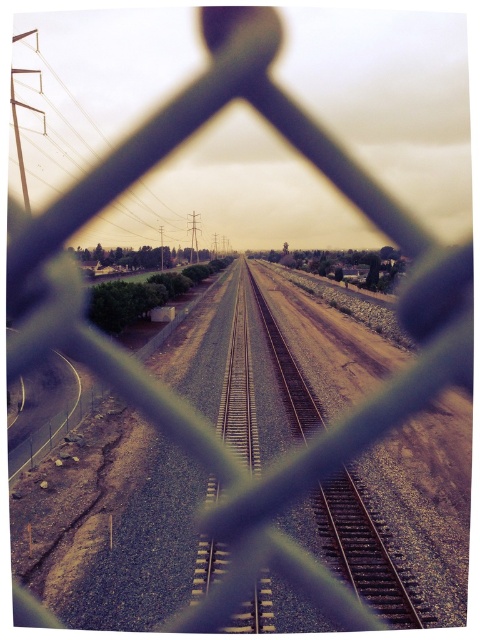
You are a maintenance worker needing to inspect both the rusty metal train track at center and the metallic silver power line at upper left. Given that you can walk at a speed of 1.5 meters per second, how many seconds will it take you to walk from one to the other?

The rusty metal train track at center and the metallic silver power line at upper left are 190.44 meters apart from each other. At a walking speed of 1.5 meters per second, it would take approximately 127 seconds to walk between them.

You are a bird flying over the scene. You want to land on the tallest object between the rusty metal train track at center and the metallic silver power line at upper left. Which object should you choose?

The metallic silver power line at upper left is taller than the rusty metal train track at center, so you should land on the metallic silver power line at upper left.

You are standing behind the chain link fence looking at the scene. Can you see the metallic silver power line at upper left through the rusty metal train track at center?

Yes, because the rusty metal train track at center is in front of the metallic silver power line at upper left, so the power line is behind the track and partially visible through the gaps in the track.